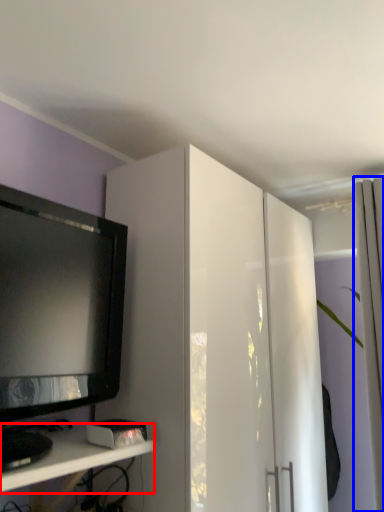
Question: Which point is closer to the camera, shelf (highlighted by a red box) or curtain (highlighted by a blue box)?

Choices:
 (A) shelf
 (B) curtain

Answer: (A)